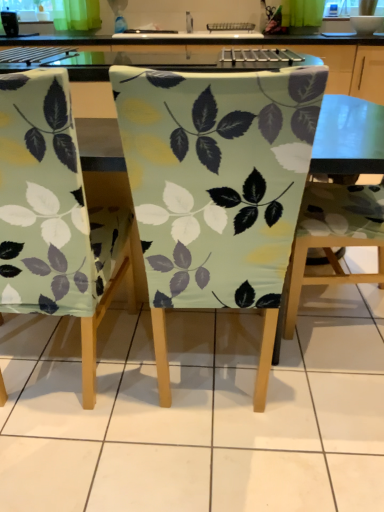
Question: From the image's perspective, is matte fabric chair at center, which is the second chair from right to left, on top of matte fabric chair at center, which is counted as the 3th chair, starting from the left?

Choices:
 (A) yes
 (B) no

Answer: (B)

Question: Considering the relative sizes of matte fabric chair at center, the 2th chair when ordered from left to right, and matte fabric chair at center, which is counted as the 3th chair, starting from the left, in the image provided, is matte fabric chair at center, the 2th chair when ordered from left to right, taller than matte fabric chair at center, which is counted as the 3th chair, starting from the left,?

Choices:
 (A) yes
 (B) no

Answer: (A)

Question: Is matte fabric chair at center, the 2th chair when ordered from left to right, turned away from matte fabric chair at center, which is counted as the 3th chair, starting from the left?

Choices:
 (A) no
 (B) yes

Answer: (A)

Question: Is matte fabric chair at center, the 2th chair when ordered from left to right, in front of matte fabric chair at center, which is counted as the 3th chair, starting from the left?

Choices:
 (A) no
 (B) yes

Answer: (B)

Question: Can you confirm if matte fabric chair at center, which is the second chair from right to left, is thinner than matte fabric chair at center, which is counted as the 3th chair, starting from the left?

Choices:
 (A) no
 (B) yes

Answer: (B)

Question: In terms of height, does matte green fabric chair at center, the 3th chair from the right, look taller or shorter compared to matte fabric chair at center, which is counted as the 3th chair, starting from the left?

Choices:
 (A) short
 (B) tall

Answer: (B)

Question: Looking at their shapes, would you say matte green fabric chair at center, the 3th chair from the right, is wider or thinner than matte fabric chair at center, which is counted as the 3th chair, starting from the left?

Choices:
 (A) thin
 (B) wide

Answer: (A)

Question: Would you say matte green fabric chair at center, which ranks as the 1th chair in left-to-right order, is to the left or to the right of matte fabric chair at center, which is counted as the 3th chair, starting from the left, in the picture?

Choices:
 (A) left
 (B) right

Answer: (A)

Question: From the image's perspective, relative to matte fabric chair at center, marked as the first chair in a right-to-left arrangement, is matte green fabric chair at center, which ranks as the 1th chair in left-to-right order, above or below?

Choices:
 (A) above
 (B) below

Answer: (B)

Question: Visually, is matte fabric chair at center, marked as the first chair in a right-to-left arrangement, positioned to the left or to the right of matte green fabric chair at center, the 3th chair from the right?

Choices:
 (A) right
 (B) left

Answer: (A)

Question: Considering the positions of matte fabric chair at center, marked as the first chair in a right-to-left arrangement, and matte green fabric chair at center, which ranks as the 1th chair in left-to-right order, in the image, is matte fabric chair at center, marked as the first chair in a right-to-left arrangement, taller or shorter than matte green fabric chair at center, which ranks as the 1th chair in left-to-right order,?

Choices:
 (A) tall
 (B) short

Answer: (B)

Question: Do you think matte fabric chair at center, marked as the first chair in a right-to-left arrangement, is within matte green fabric chair at center, the 3th chair from the right, or outside of it?

Choices:
 (A) outside
 (B) inside

Answer: (A)

Question: Looking at their shapes, would you say matte fabric chair at center, which is counted as the 3th chair, starting from the left, is wider or thinner than matte green fabric chair at center, which ranks as the 1th chair in left-to-right order?

Choices:
 (A) wide
 (B) thin

Answer: (A)

Question: From the image's perspective, is matte fabric chair at center, marked as the first chair in a right-to-left arrangement, located above or below matte fabric chair at center, which is the second chair from right to left?

Choices:
 (A) below
 (B) above

Answer: (B)

Question: Considering the relative positions of matte fabric chair at center, which is counted as the 3th chair, starting from the left, and matte fabric chair at center, which is the second chair from right to left, in the image provided, is matte fabric chair at center, which is counted as the 3th chair, starting from the left, to the left or to the right of matte fabric chair at center, which is the second chair from right to left,?

Choices:
 (A) right
 (B) left

Answer: (A)